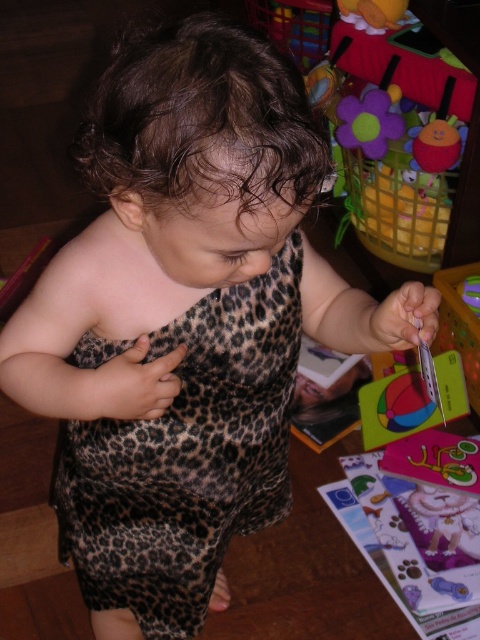
What are the coordinates of the leopard print fabric dress at center?

The leopard print fabric dress at center is located at point (187, 458).

You are a robot trying to navigate to the point at coordinates point (220, 556). You are currently at point (415, 99). According to the scene, which direction should you move to reach your destination?

Point (220, 556) is in front of point (415, 99), so you should move forward to reach the destination.

You are a photographer setting up a shot in the playroom. You want to position a light source to the right of the leopard print fabric dress at center so it illuminates the fluffy fabric flower at upper right. Is the light placement possible based on their positions?

The leopard print fabric dress at center is to the left of the fluffy fabric flower at upper right, so placing the light source to the right of the leopard print fabric dress at center would position it towards the fluffy fabric flower at upper right, making it possible to illuminate it.